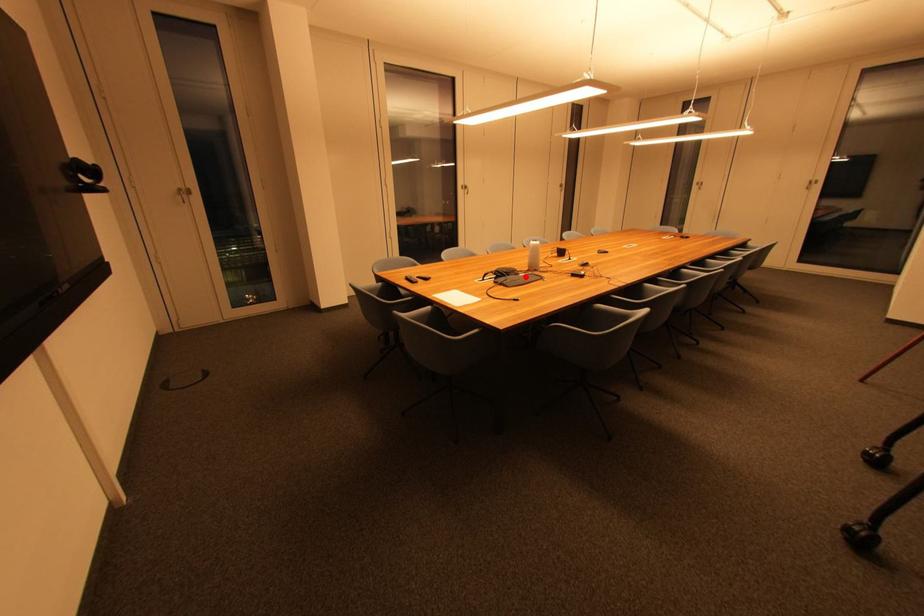
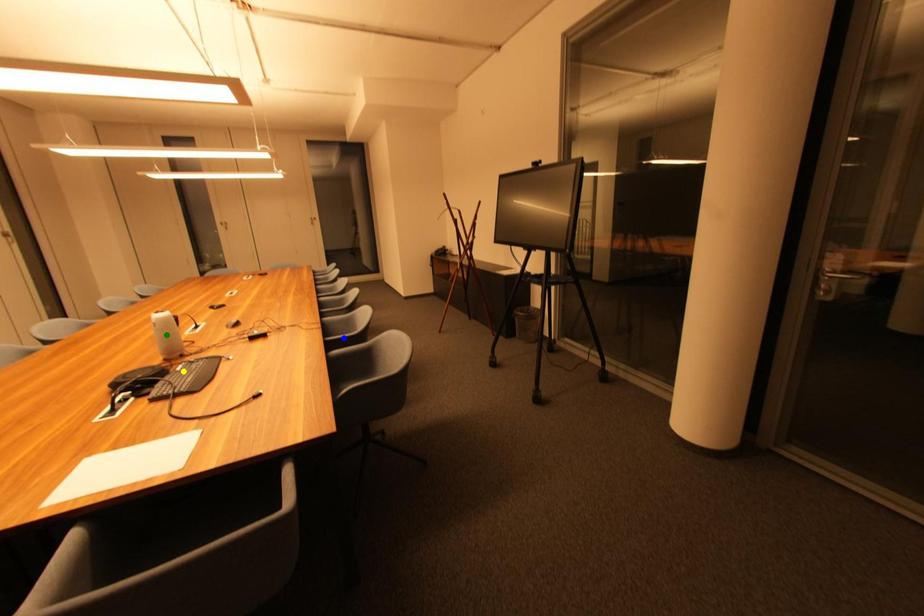
Question: I am providing you with two images of the same scene from different viewpoints. A red point is marked on the first image. You are given multiple points on the second image. Which mark in image 2 goes with the point in image 1?

Choices:
 (A) green point
 (B) yellow point
 (C) blue point

Answer: (B)